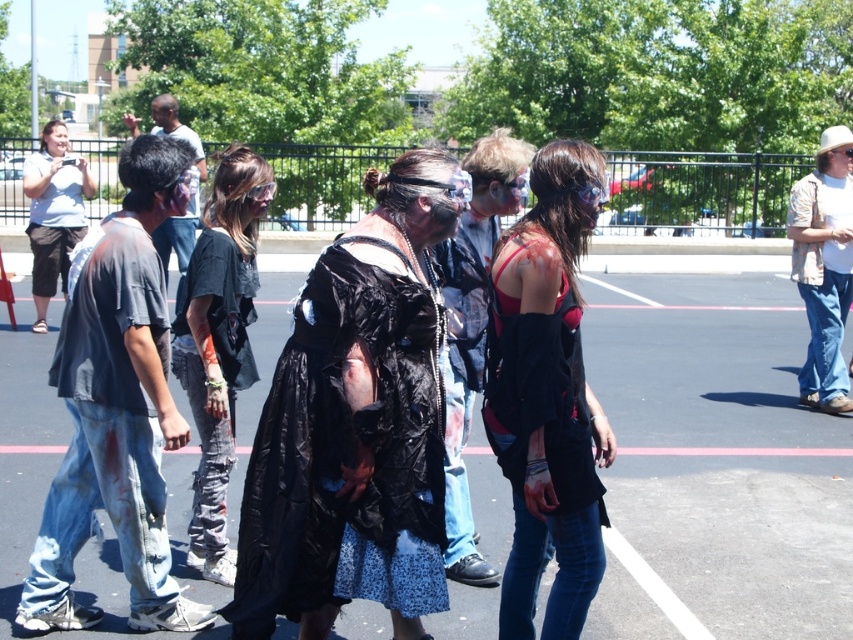
Between black plastic bag at center and black plastic dress at center, which one is positioned higher?

black plastic bag at center is higher up.

Between black plastic bag at center and black plastic dress at center, which one appears on the left side from the viewer's perspective?

black plastic bag at center is more to the left.

This screenshot has width=853, height=640. Find the location of `black plastic bag at center`. black plastic bag at center is located at coordinates (717, 461).

At what (x,y) coordinates should I click in order to perform the action: click on black plastic bag at center. Please return your answer as a coordinate pair (x, y). Looking at the image, I should click on (717, 461).

Does point (345, 596) lie behind point (544, 520)?

No.

Is black plastic dress at center to the right of matte black vest at center from the viewer's perspective?

Incorrect, black plastic dress at center is not on the right side of matte black vest at center.

Locate an element on the screen. This screenshot has width=853, height=640. black plastic dress at center is located at coordinates (345, 449).

Does matte black jacket at center have a greater height compared to matte black shirt at left?

No, matte black jacket at center is not taller than matte black shirt at left.

Consider the image. Between matte black jacket at center and matte black shirt at left, which one has more height?

With more height is matte black shirt at left.

Where is `matte black jacket at center`? Image resolution: width=853 pixels, height=640 pixels. matte black jacket at center is located at coordinates (473, 326).